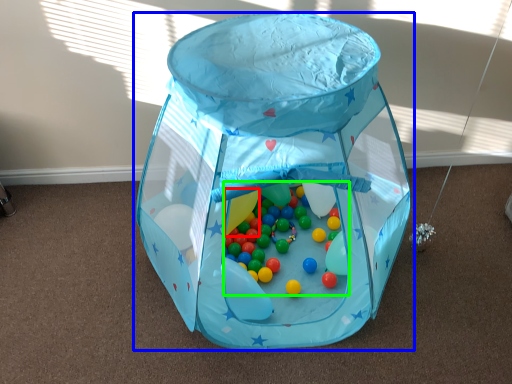
Question: Based on their relative distances, which object is nearer to balloon (highlighted by a red box)? Choose from toy (highlighted by a blue box) and toy (highlighted by a green box).

Choices:
 (A) toy
 (B) toy

Answer: (B)